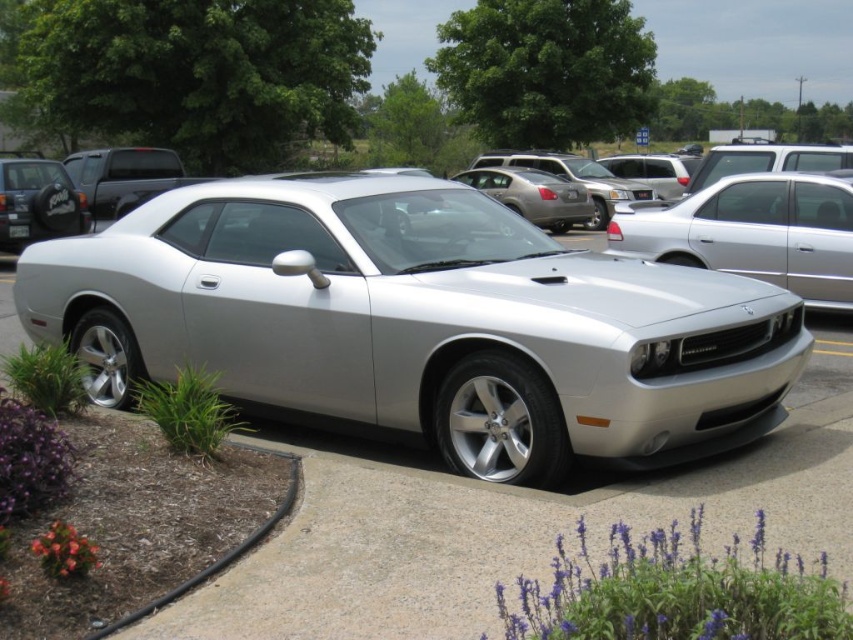
Looking at this image, can you confirm if matte black suv at left is positioned to the left of black plastic license plate at center?

No, matte black suv at left is not to the left of black plastic license plate at center.

Is point (6, 161) positioned in front of point (19, 232)?

No, (6, 161) is further to viewer.

Find the location of a particular element. This screenshot has width=853, height=640. matte black suv at left is located at coordinates (38, 202).

Who is more forward, (97,323) or (804,172)?

Point (97,323)

Looking at this image, is the position of silver metallic sports car at center less distant than that of satin silver car at center?

Yes.

Which is behind, point (96, 337) or point (613, 216)?

The point (613, 216) is more distant.

Where is `silver metallic sports car at center`? Image resolution: width=853 pixels, height=640 pixels. silver metallic sports car at center is located at coordinates (418, 323).

Can you confirm if silver metallic sports car at center is bigger than satin black truck at upper left?

Yes.

Between silver metallic sports car at center and satin black truck at upper left, which one appears on the left side from the viewer's perspective?

satin black truck at upper left is more to the left.

Who is more distant from viewer, (55,285) or (173,173)?

The point (173,173) is behind.

This screenshot has height=640, width=853. I want to click on silver metallic sports car at center, so click(x=418, y=323).